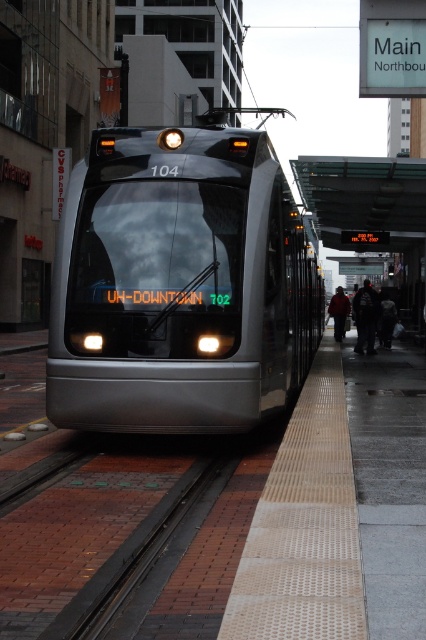
Based on the photo, you are a passenger waiting on the platform and see the polished metal train at center and the dark gray jacket at center. Which object is closer to you?

The polished metal train at center is closer to you because it is in front of the dark gray jacket at center.

You are standing on the platform waiting for the train. You see the polished metal train at center and the black fabric commuter at center. Which object is nearer to you?

The polished metal train at center is closer to the viewer than the black fabric commuter at center, so the polished metal train at center is nearer.

Looking at this image, you are a passenger waiting on the perforated beige platform at center. You want to board the polished metal train at center. Based on their sizes, which one is easier to step onto?

The polished metal train at center is smaller than the perforated beige platform at center, so it might be easier to step onto the train since it has a lower step compared to the platform.